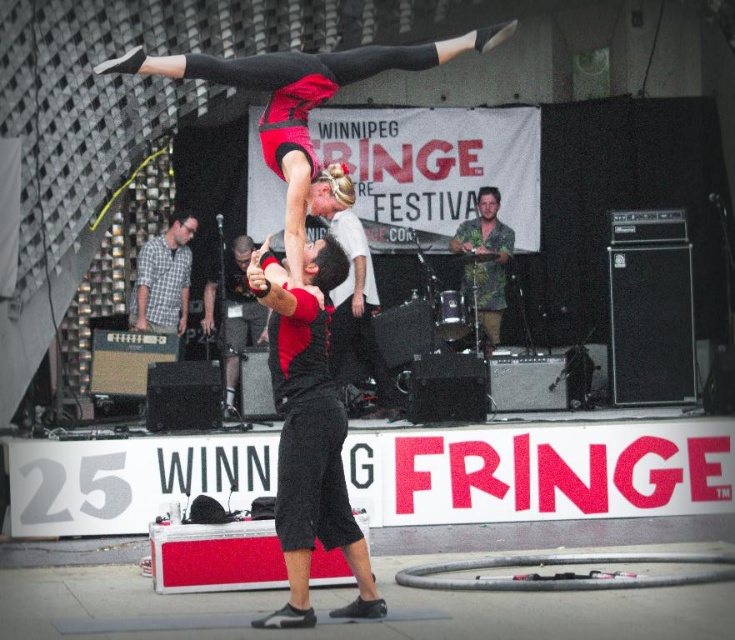
Is black matte shorts at center positioned behind green textured shirt at center?

No.

Can you confirm if black matte shorts at center is taller than green textured shirt at center?

Yes.

At what (x,y) coordinates should I click in order to perform the action: click on black matte shorts at center. Please return your answer as a coordinate pair (x, y). The width and height of the screenshot is (735, 640). Looking at the image, I should click on (232, 312).

Locate an element on the screen. black matte shorts at center is located at coordinates (232, 312).

Is point (184, 276) positioned behind point (487, 308)?

No, (184, 276) is closer to viewer.

Who is more forward, (176,330) or (498,202)?

Point (176,330) is in front.

Locate an element on the screen. This screenshot has width=735, height=640. plaid shirt at center is located at coordinates (164, 278).

Which is more to the right, plaid shirt at center or black matte shorts at center?

Positioned to the right is black matte shorts at center.

Is the position of plaid shirt at center more distant than that of black matte shorts at center?

Yes, plaid shirt at center is further from the viewer.

The image size is (735, 640). I want to click on plaid shirt at center, so click(x=164, y=278).